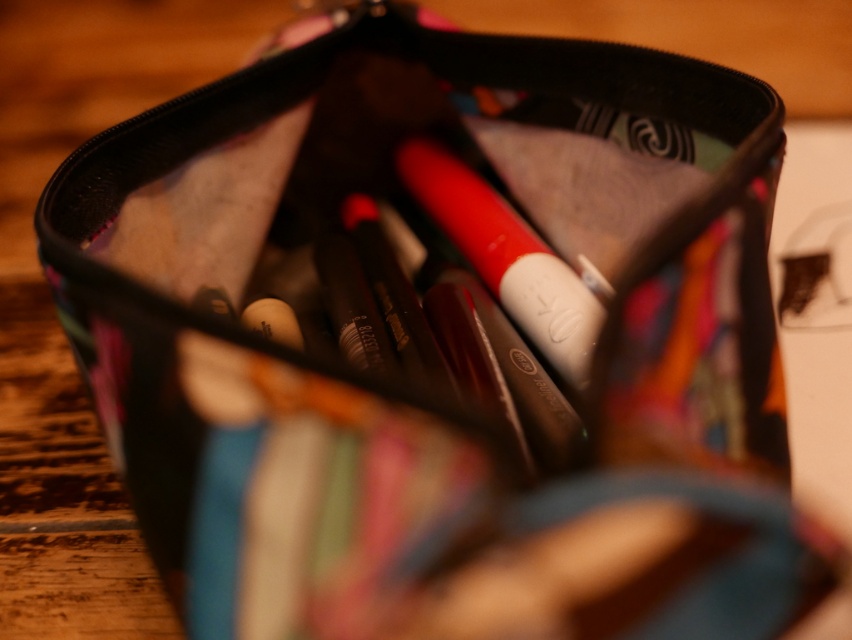
Question: Where is matte white lipstick at center located in relation to matte white eraser at center in the image?

Choices:
 (A) right
 (B) left

Answer: (A)

Question: Which object appears farthest from the camera in this image?

Choices:
 (A) matte white lipstick at center
 (B) matte white eraser at center

Answer: (B)

Question: Can you confirm if matte white lipstick at center is smaller than matte white eraser at center?

Choices:
 (A) no
 (B) yes

Answer: (A)

Question: Considering the relative positions of matte white lipstick at center and matte white eraser at center in the image provided, where is matte white lipstick at center located with respect to matte white eraser at center?

Choices:
 (A) above
 (B) below

Answer: (A)